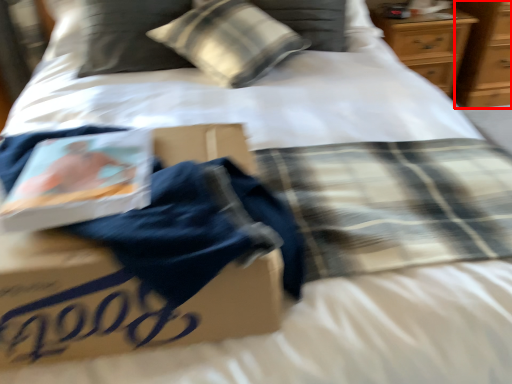
Question: From the image's perspective, considering the relative positions of dresser (annotated by the red box) and pillow in the image provided, where is dresser (annotated by the red box) located with respect to the staircase?

Choices:
 (A) above
 (B) below

Answer: (A)